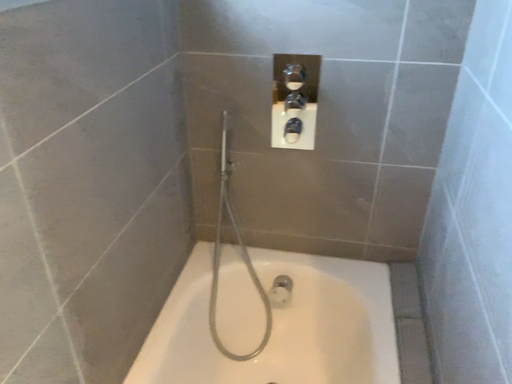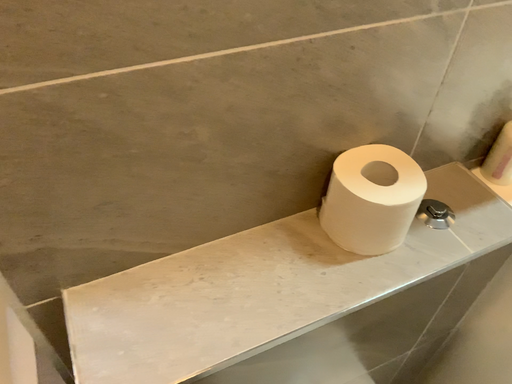
Question: Which way did the camera rotate in the video?

Choices:
 (A) rotated downward
 (B) rotated upward

Answer: (A)